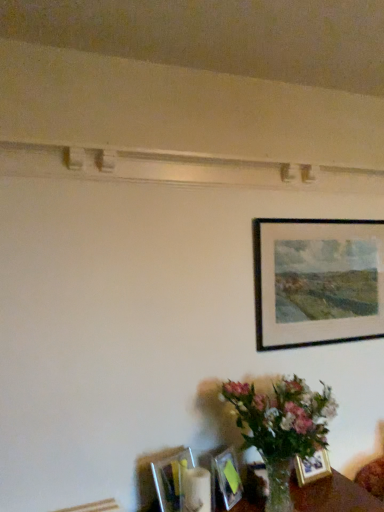
The width and height of the screenshot is (384, 512). Describe the element at coordinates (171, 479) in the screenshot. I see `metallic silver picture frame at lower center, which is the 2th picture frame in top-to-bottom order` at that location.

Describe the element at coordinates (317, 281) in the screenshot. I see `black matte picture frame at upper right, which is the 1th picture frame in right-to-left order` at that location.

This screenshot has height=512, width=384. Identify the location of matte glass picture frame at lower center, the 3th picture frame in the top-to-bottom sequence. (225, 479).

Do you think matte glass picture frame at lower center, the second picture frame in the left-to-right sequence, is within gold metallic picture frame at lower right, which is the 4th picture frame in top-to-bottom order, or outside of it?

matte glass picture frame at lower center, the second picture frame in the left-to-right sequence, is outside gold metallic picture frame at lower right, which is the 4th picture frame in top-to-bottom order.

From the picture: From the image's perspective, is matte glass picture frame at lower center, which ranks as the second picture frame in bottom-to-top order, over gold metallic picture frame at lower right, which is the 4th picture frame in top-to-bottom order?

Yes, from the image's perspective, matte glass picture frame at lower center, which ranks as the second picture frame in bottom-to-top order, is above gold metallic picture frame at lower right, which is the 4th picture frame in top-to-bottom order.

Which point is more forward, [219,503] or [299,460]?

The point [219,503] is in front.

Does matte glass picture frame at lower center, which is the third picture frame in right-to-left order, touch gold metallic picture frame at lower right, the third picture frame positioned from the left?

A: No, matte glass picture frame at lower center, which is the third picture frame in right-to-left order, is not touching gold metallic picture frame at lower right, the third picture frame positioned from the left.

Who is shorter, gold metallic picture frame at lower right, the third picture frame positioned from the left, or metallic silver picture frame at lower center, acting as the 1th picture frame starting from the left?

With less height is gold metallic picture frame at lower right, the third picture frame positioned from the left.

Which object is positioned more to the right, gold metallic picture frame at lower right, acting as the second picture frame starting from the right, or metallic silver picture frame at lower center, which is the 2th picture frame in top-to-bottom order?

Positioned to the right is gold metallic picture frame at lower right, acting as the second picture frame starting from the right.

Does point (308, 463) appear closer or farther from the camera than point (163, 493)?

Clearly, point (308, 463) is more distant from the camera than point (163, 493).

Between gold metallic picture frame at lower right, acting as the second picture frame starting from the right, and metallic silver picture frame at lower center, which is counted as the fourth picture frame, starting from the right, which one has larger width?

metallic silver picture frame at lower center, which is counted as the fourth picture frame, starting from the right, is wider.

Which is behind, metallic silver picture frame at lower center, acting as the 1th picture frame starting from the left, or gold metallic picture frame at lower right, acting as the second picture frame starting from the right?

gold metallic picture frame at lower right, acting as the second picture frame starting from the right, is more distant.

Would you consider metallic silver picture frame at lower center, acting as the 1th picture frame starting from the left, to be distant from gold metallic picture frame at lower right, the third picture frame positioned from the left?

That's not correct — metallic silver picture frame at lower center, acting as the 1th picture frame starting from the left, is a little close to gold metallic picture frame at lower right, the third picture frame positioned from the left.

From the image's perspective, is metallic silver picture frame at lower center, acting as the 1th picture frame starting from the left, above or below gold metallic picture frame at lower right, the 1th picture frame positioned from the bottom?

Based on their image positions, metallic silver picture frame at lower center, acting as the 1th picture frame starting from the left, is located above gold metallic picture frame at lower right, the 1th picture frame positioned from the bottom.

In order to click on the 1st picture frame in front of the black matte picture frame at upper right, placed as the 4th picture frame when sorted from left to right, counting from the anchor's position in this screenshot , I will do `click(312, 467)`.

Is black matte picture frame at upper right, which ranks as the 4th picture frame in bottom-to-top order, next to gold metallic picture frame at lower right, acting as the second picture frame starting from the right?

No, black matte picture frame at upper right, which ranks as the 4th picture frame in bottom-to-top order, is not beside gold metallic picture frame at lower right, acting as the second picture frame starting from the right.

How many degrees apart are the facing directions of black matte picture frame at upper right, which is the 1th picture frame in right-to-left order, and gold metallic picture frame at lower right, the third picture frame positioned from the left?

5.63 degrees separate the facing orientations of black matte picture frame at upper right, which is the 1th picture frame in right-to-left order, and gold metallic picture frame at lower right, the third picture frame positioned from the left.

Is black matte picture frame at upper right, which is the 1th picture frame in right-to-left order, outside of gold metallic picture frame at lower right, which is the 4th picture frame in top-to-bottom order?

Yes, black matte picture frame at upper right, which is the 1th picture frame in right-to-left order, is outside of gold metallic picture frame at lower right, which is the 4th picture frame in top-to-bottom order.

From a real-world perspective, is gold metallic picture frame at lower right, which is the 4th picture frame in top-to-bottom order, on top of matte glass picture frame at lower center, which ranks as the second picture frame in bottom-to-top order?

No, from a real-world perspective, gold metallic picture frame at lower right, which is the 4th picture frame in top-to-bottom order, is not above matte glass picture frame at lower center, which ranks as the second picture frame in bottom-to-top order.

In the scene shown: Which of these two, gold metallic picture frame at lower right, which is the 4th picture frame in top-to-bottom order, or matte glass picture frame at lower center, which is the third picture frame in right-to-left order, is wider?

matte glass picture frame at lower center, which is the third picture frame in right-to-left order, is wider.

Is gold metallic picture frame at lower right, acting as the second picture frame starting from the right, next to matte glass picture frame at lower center, which is the third picture frame in right-to-left order?

gold metallic picture frame at lower right, acting as the second picture frame starting from the right, is not next to matte glass picture frame at lower center, which is the third picture frame in right-to-left order, and they're not touching.

Looking at this image, could you tell me if gold metallic picture frame at lower right, which is the 4th picture frame in top-to-bottom order, is facing matte glass picture frame at lower center, which ranks as the second picture frame in bottom-to-top order?

No, gold metallic picture frame at lower right, which is the 4th picture frame in top-to-bottom order, is not oriented towards matte glass picture frame at lower center, which ranks as the second picture frame in bottom-to-top order.

Is point (181, 460) positioned after point (354, 324)?

No.

From the image's perspective, which object appears higher, metallic silver picture frame at lower center, the 3th picture frame positioned from the bottom, or black matte picture frame at upper right, which is the 1th picture frame in right-to-left order?

black matte picture frame at upper right, which is the 1th picture frame in right-to-left order.

Can you confirm if metallic silver picture frame at lower center, acting as the 1th picture frame starting from the left, is taller than black matte picture frame at upper right, which ranks as the 4th picture frame in bottom-to-top order?

Incorrect, the height of metallic silver picture frame at lower center, acting as the 1th picture frame starting from the left, is not larger of that of black matte picture frame at upper right, which ranks as the 4th picture frame in bottom-to-top order.

Would you say metallic silver picture frame at lower center, acting as the 1th picture frame starting from the left, is a long distance from black matte picture frame at upper right, placed as the 4th picture frame when sorted from left to right?

That's not correct — metallic silver picture frame at lower center, acting as the 1th picture frame starting from the left, is a little close to black matte picture frame at upper right, placed as the 4th picture frame when sorted from left to right.

You are a GUI agent. You are given a task and a screenshot of the screen. Output one action in this format:
    pyautogui.click(x=<x>, y=<y>)
    Task: Click on the 1st picture frame above the matte glass picture frame at lower center, the second picture frame in the left-to-right sequence (from a real-world perspective)
    
    Given the screenshot: What is the action you would take?
    [x=171, y=479]

Consider the image. How many degrees apart are the facing directions of metallic silver picture frame at lower center, acting as the 1th picture frame starting from the left, and matte glass picture frame at lower center, the second picture frame in the left-to-right sequence?

There is a 7.49-degree angle between the facing directions of metallic silver picture frame at lower center, acting as the 1th picture frame starting from the left, and matte glass picture frame at lower center, the second picture frame in the left-to-right sequence.

From a real-world perspective, does metallic silver picture frame at lower center, which is the 2th picture frame in top-to-bottom order, stand above matte glass picture frame at lower center, the 3th picture frame in the top-to-bottom sequence?

Yes, from a real-world perspective, metallic silver picture frame at lower center, which is the 2th picture frame in top-to-bottom order, is above matte glass picture frame at lower center, the 3th picture frame in the top-to-bottom sequence.

The image size is (384, 512). There is a gold metallic picture frame at lower right, the third picture frame positioned from the left. Identify the location of the 1st picture frame above it (from the image's perspective). (225, 479).

The image size is (384, 512). Find the location of `the 2nd picture frame directly beneath the metallic silver picture frame at lower center, which is the 2th picture frame in top-to-bottom order (from a real-world perspective)`. the 2nd picture frame directly beneath the metallic silver picture frame at lower center, which is the 2th picture frame in top-to-bottom order (from a real-world perspective) is located at coordinates (312, 467).

Which object lies nearer to the anchor point matte glass picture frame at lower center, the 3th picture frame in the top-to-bottom sequence, gold metallic picture frame at lower right, acting as the second picture frame starting from the right, or black matte picture frame at upper right, which is the 1th picture frame in right-to-left order?

gold metallic picture frame at lower right, acting as the second picture frame starting from the right, lies closer to matte glass picture frame at lower center, the 3th picture frame in the top-to-bottom sequence, than the other object.

Which object lies nearer to the anchor point matte glass picture frame at lower center, which ranks as the second picture frame in bottom-to-top order, black matte picture frame at upper right, placed as the 4th picture frame when sorted from left to right, or metallic silver picture frame at lower center, which is counted as the fourth picture frame, starting from the right?

metallic silver picture frame at lower center, which is counted as the fourth picture frame, starting from the right, is positioned closer to the anchor matte glass picture frame at lower center, which ranks as the second picture frame in bottom-to-top order.

Consider the image. Based on their spatial positions, is black matte picture frame at upper right, placed as the 4th picture frame when sorted from left to right, or gold metallic picture frame at lower right, the third picture frame positioned from the left, closer to metallic silver picture frame at lower center, which is counted as the fourth picture frame, starting from the right?

gold metallic picture frame at lower right, the third picture frame positioned from the left, is positioned closer to the anchor metallic silver picture frame at lower center, which is counted as the fourth picture frame, starting from the right.

Which object lies nearer to the anchor point black matte picture frame at upper right, which ranks as the 4th picture frame in bottom-to-top order, gold metallic picture frame at lower right, which is the 4th picture frame in top-to-bottom order, or metallic silver picture frame at lower center, which is the 2th picture frame in top-to-bottom order?

The object closer to black matte picture frame at upper right, which ranks as the 4th picture frame in bottom-to-top order, is gold metallic picture frame at lower right, which is the 4th picture frame in top-to-bottom order.

Which object lies nearer to the anchor point black matte picture frame at upper right, which is the 1th picture frame in right-to-left order, matte glass picture frame at lower center, which ranks as the second picture frame in bottom-to-top order, or gold metallic picture frame at lower right, the third picture frame positioned from the left?

gold metallic picture frame at lower right, the third picture frame positioned from the left, is positioned closer to the anchor black matte picture frame at upper right, which is the 1th picture frame in right-to-left order.

Estimate the real-world distances between objects in this image. Which object is further from gold metallic picture frame at lower right, acting as the second picture frame starting from the right, metallic silver picture frame at lower center, acting as the 1th picture frame starting from the left, or matte glass picture frame at lower center, which ranks as the second picture frame in bottom-to-top order?

Based on the image, metallic silver picture frame at lower center, acting as the 1th picture frame starting from the left, appears to be further to gold metallic picture frame at lower right, acting as the second picture frame starting from the right.

When comparing their distances from metallic silver picture frame at lower center, which is the 2th picture frame in top-to-bottom order, does gold metallic picture frame at lower right, the 1th picture frame positioned from the bottom, or black matte picture frame at upper right, which is the 1th picture frame in right-to-left order, seem closer?

The object closer to metallic silver picture frame at lower center, which is the 2th picture frame in top-to-bottom order, is gold metallic picture frame at lower right, the 1th picture frame positioned from the bottom.

When comparing their distances from black matte picture frame at upper right, which ranks as the 4th picture frame in bottom-to-top order, does gold metallic picture frame at lower right, the third picture frame positioned from the left, or matte glass picture frame at lower center, the 3th picture frame in the top-to-bottom sequence, seem closer?

gold metallic picture frame at lower right, the third picture frame positioned from the left, lies closer to black matte picture frame at upper right, which ranks as the 4th picture frame in bottom-to-top order, than the other object.

The image size is (384, 512). I want to click on picture frame that lies between black matte picture frame at upper right, which is the 1th picture frame in right-to-left order, and matte glass picture frame at lower center, the second picture frame in the left-to-right sequence, from top to bottom, so click(x=171, y=479).

Where is `picture frame located between metallic silver picture frame at lower center, the 3th picture frame positioned from the bottom, and gold metallic picture frame at lower right, acting as the second picture frame starting from the right, in the left-right direction`? The width and height of the screenshot is (384, 512). picture frame located between metallic silver picture frame at lower center, the 3th picture frame positioned from the bottom, and gold metallic picture frame at lower right, acting as the second picture frame starting from the right, in the left-right direction is located at coordinates (225, 479).